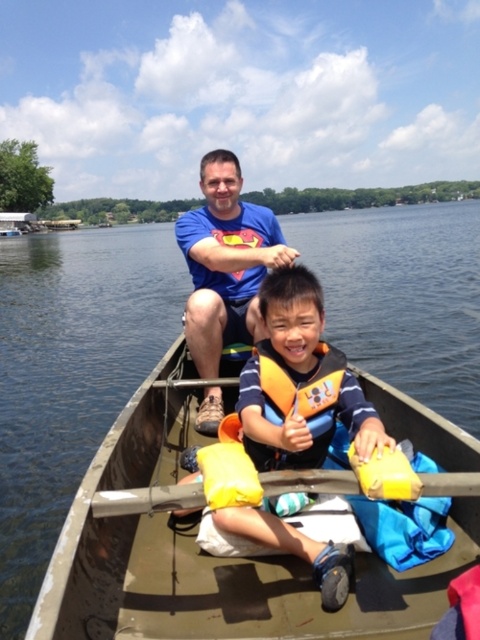
Does clear blue water at center have a smaller size compared to yellow foam life jacket at center?

Actually, clear blue water at center might be larger than yellow foam life jacket at center.

Based on the photo, is clear blue water at center taller than yellow foam life jacket at center?

Indeed, clear blue water at center has a greater height compared to yellow foam life jacket at center.

Does point (16, 468) come in front of point (272, 390)?

No, (16, 468) is behind (272, 390).

You are a GUI agent. You are given a task and a screenshot of the screen. Output one action in this format:
    pyautogui.click(x=<x>, y=<y>)
    Task: Click on the clear blue water at center
    This screenshot has height=640, width=480.
    Given the screenshot: What is the action you would take?
    pyautogui.click(x=71, y=371)

Consider the image. Which is above, orange life vest at center or yellow foam paddle at center?

orange life vest at center is higher up.

Between point (255, 525) and point (269, 490), which one is positioned in front?

Positioned in front is point (269, 490).

This screenshot has width=480, height=640. I want to click on orange life vest at center, so click(300, 381).

Can you confirm if matte blue shirt at center is smaller than yellow foam paddle at center?

Actually, matte blue shirt at center might be larger than yellow foam paddle at center.

Does matte blue shirt at center have a lesser height compared to yellow foam paddle at center?

No, matte blue shirt at center is not shorter than yellow foam paddle at center.

The width and height of the screenshot is (480, 640). In order to click on matte blue shirt at center in this screenshot , I will do `click(226, 262)`.